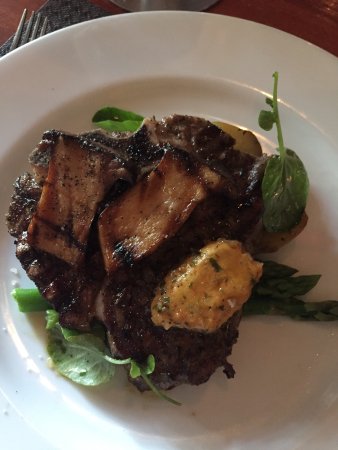
This screenshot has height=450, width=338. What are the coordinates of `fork` in the screenshot? It's located at [x=31, y=28].